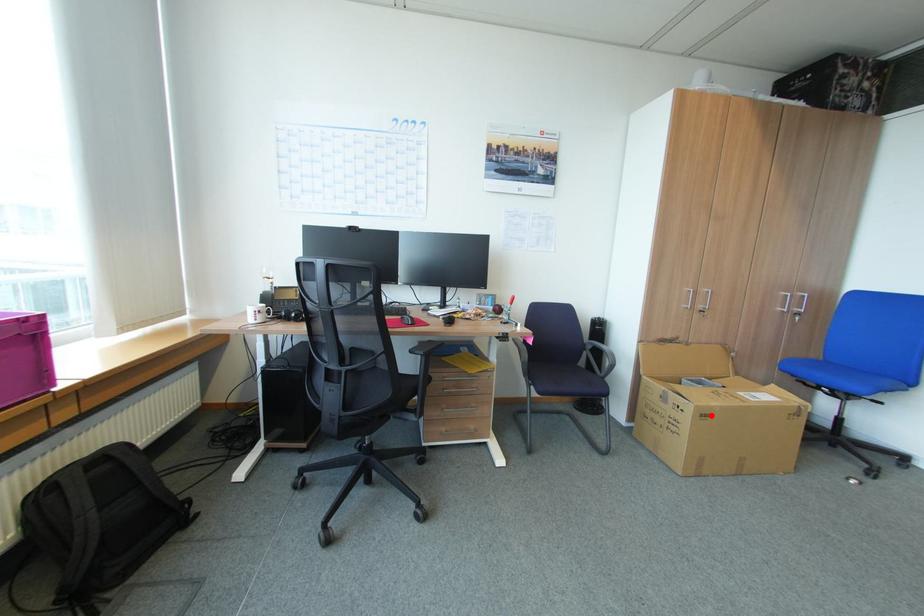
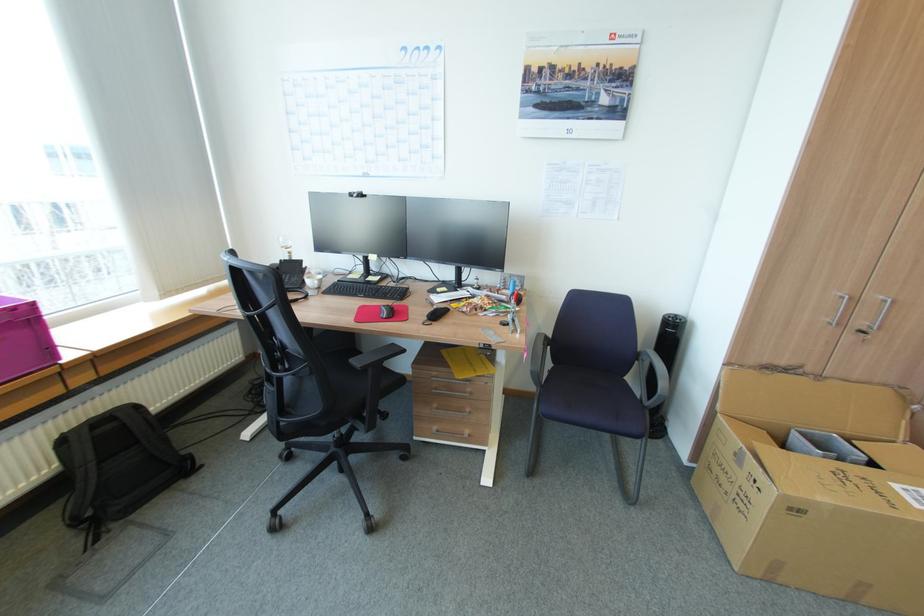
Question: I am providing you with two images of the same scene from different viewpoints. A red point is shown in image1. For the corresponding object point in image2, is it positioned nearer or farther from the camera?

Choices:
 (A) Nearer
 (B) Farther

Answer: (A)